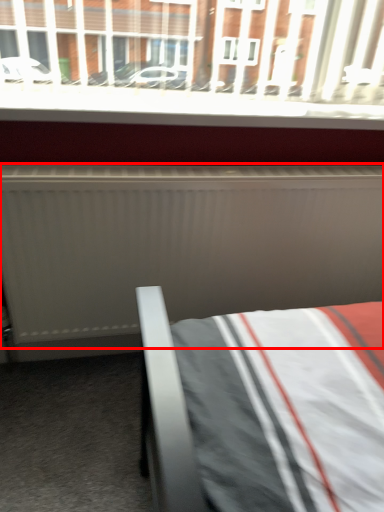
Question: Considering the relative positions of radiator (annotated by the red box) and window sill in the image provided, where is radiator (annotated by the red box) located with respect to the staircase?

Choices:
 (A) left
 (B) right

Answer: (B)